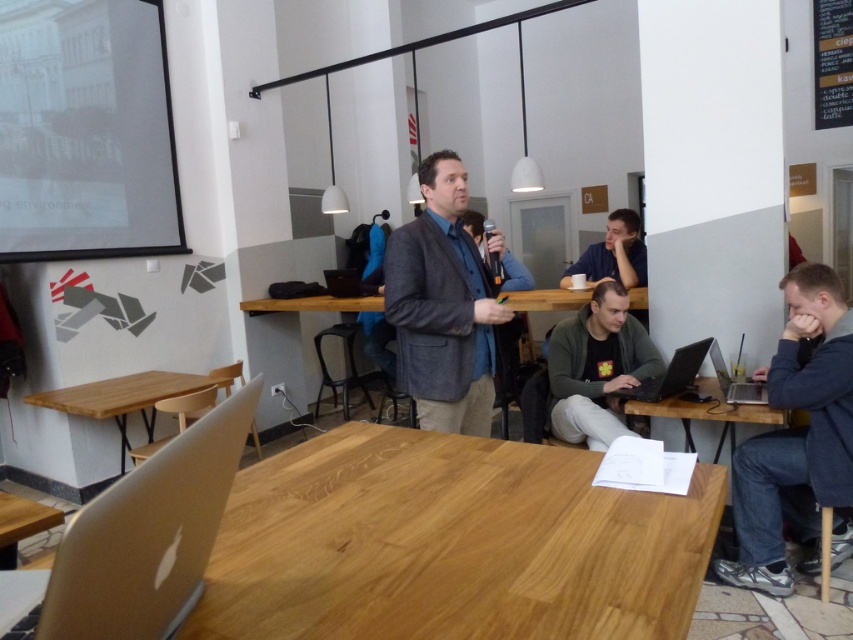
Question: Which object is closer to the camera taking this photo?

Choices:
 (A) dark green sweater at center
 (B) dark blue sweater at lower right
 (C) silver metallic laptop at lower left
 (D) natural wood table at center

Answer: (C)

Question: Can you confirm if gray woolen blazer at center is bigger than dark blue shirt at upper right?

Choices:
 (A) no
 (B) yes

Answer: (B)

Question: Which point is farther to the camera?

Choices:
 (A) (402, 465)
 (B) (358, 278)
 (C) (360, 296)
 (D) (730, 392)

Answer: (B)

Question: Which point is closer to the camera?

Choices:
 (A) dark blue shirt at upper right
 (B) dark green sweater at center

Answer: (B)

Question: Where is dark green sweater at center located in relation to silver metallic laptop at lower right in the image?

Choices:
 (A) above
 (B) below

Answer: (A)

Question: Is natural wood table at lower left wider than silver metallic laptop at lower right?

Choices:
 (A) no
 (B) yes

Answer: (B)